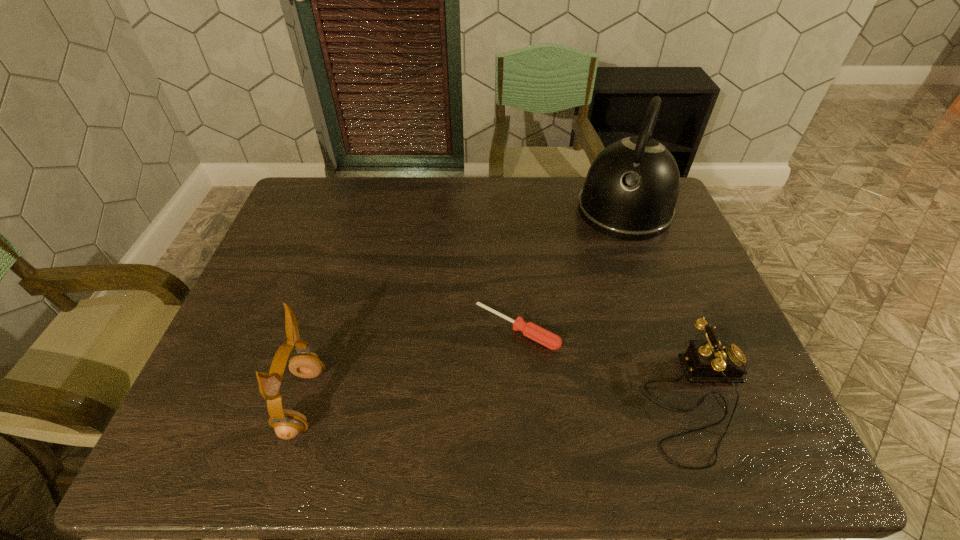
You are a GUI agent. You are given a task and a screenshot of the screen. Output one action in this format:
    pyautogui.click(x=<x>, y=<y>)
    Task: Click on the vacant space situated on the spout of the kettle
    The width and height of the screenshot is (960, 540).
    Given the screenshot: What is the action you would take?
    pyautogui.click(x=580, y=336)

I want to click on free space located at the tip of the third object from right to left, so click(468, 382).

Identify the location of free spot located 0.120m at the tip of the third object from right to left. (466, 386).

Image resolution: width=960 pixels, height=540 pixels. Identify the location of free spot located at the tip of the third object from right to left. (483, 363).

Find the location of a particular element. The width and height of the screenshot is (960, 540). object that is at the far edge is located at coordinates (630, 192).

Locate an element on the screen. The image size is (960, 540). earphone that is at the near edge is located at coordinates [x=287, y=424].

Identify the location of telephone situated at the near edge. The width and height of the screenshot is (960, 540). (705, 361).

The height and width of the screenshot is (540, 960). What are the coordinates of `telephone located in the right edge section of the desktop` in the screenshot? It's located at (705, 361).

Identify the location of kettle located in the right edge section of the desktop. The width and height of the screenshot is (960, 540). (630, 192).

The width and height of the screenshot is (960, 540). What are the coordinates of `object that is at the far right corner` in the screenshot? It's located at (630, 192).